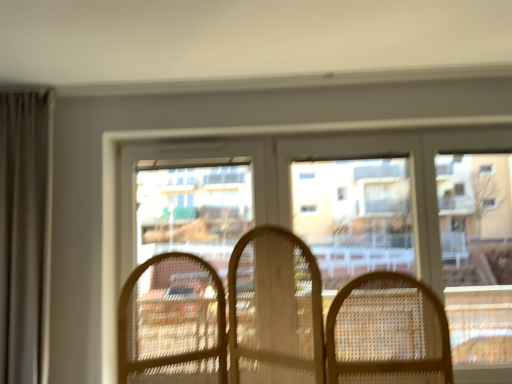
Question: Is clear plastic window screen at center to the left of translucent wicker chairs at center from the viewer's perspective?

Choices:
 (A) yes
 (B) no

Answer: (B)

Question: Does clear plastic window screen at center have a lesser width compared to translucent wicker chairs at center?

Choices:
 (A) no
 (B) yes

Answer: (B)

Question: From a real-world perspective, does clear plastic window screen at center stand above translucent wicker chairs at center?

Choices:
 (A) no
 (B) yes

Answer: (B)

Question: Does clear plastic window screen at center have a larger size compared to translucent wicker chairs at center?

Choices:
 (A) no
 (B) yes

Answer: (A)

Question: Is clear plastic window screen at center smaller than translucent wicker chairs at center?

Choices:
 (A) no
 (B) yes

Answer: (B)

Question: Based on their sizes in the image, would you say clear plastic window screen at center is bigger or smaller than translucent wicker chairs at center?

Choices:
 (A) small
 (B) big

Answer: (A)

Question: Considering the positions of clear plastic window screen at center and translucent wicker chairs at center in the image, is clear plastic window screen at center taller or shorter than translucent wicker chairs at center?

Choices:
 (A) short
 (B) tall

Answer: (B)

Question: Looking at their shapes, would you say clear plastic window screen at center is wider or thinner than translucent wicker chairs at center?

Choices:
 (A) thin
 (B) wide

Answer: (A)

Question: Would you say clear plastic window screen at center is to the left or to the right of translucent wicker chairs at center in the picture?

Choices:
 (A) left
 (B) right

Answer: (B)

Question: From a real-world perspective, is clear plastic screen door at center above or below clear plastic window screen at center?

Choices:
 (A) below
 (B) above

Answer: (A)

Question: Considering the positions of point (197, 142) and point (314, 180), is point (197, 142) closer or farther from the camera than point (314, 180)?

Choices:
 (A) farther
 (B) closer

Answer: (B)

Question: Looking at the image, does clear plastic screen door at center seem bigger or smaller compared to clear plastic window screen at center?

Choices:
 (A) big
 (B) small

Answer: (A)

Question: Looking at their shapes, would you say clear plastic screen door at center is wider or thinner than clear plastic window screen at center?

Choices:
 (A) wide
 (B) thin

Answer: (A)

Question: Is translucent wicker chairs at center bigger or smaller than clear plastic window screen at center?

Choices:
 (A) small
 (B) big

Answer: (B)

Question: From the image's perspective, is translucent wicker chairs at center above or below clear plastic window screen at center?

Choices:
 (A) below
 (B) above

Answer: (A)